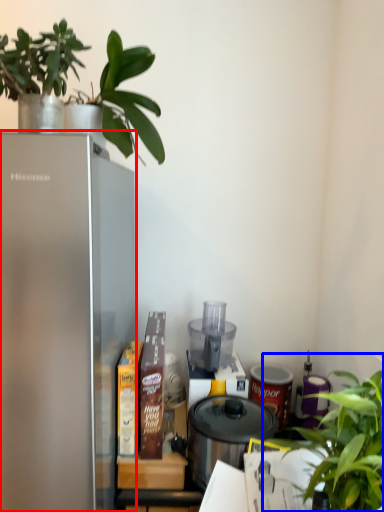
Question: Which object appears farthest to the camera in this image, refrigerator (highlighted by a red box) or houseplant (highlighted by a blue box)?

Choices:
 (A) refrigerator
 (B) houseplant

Answer: (A)